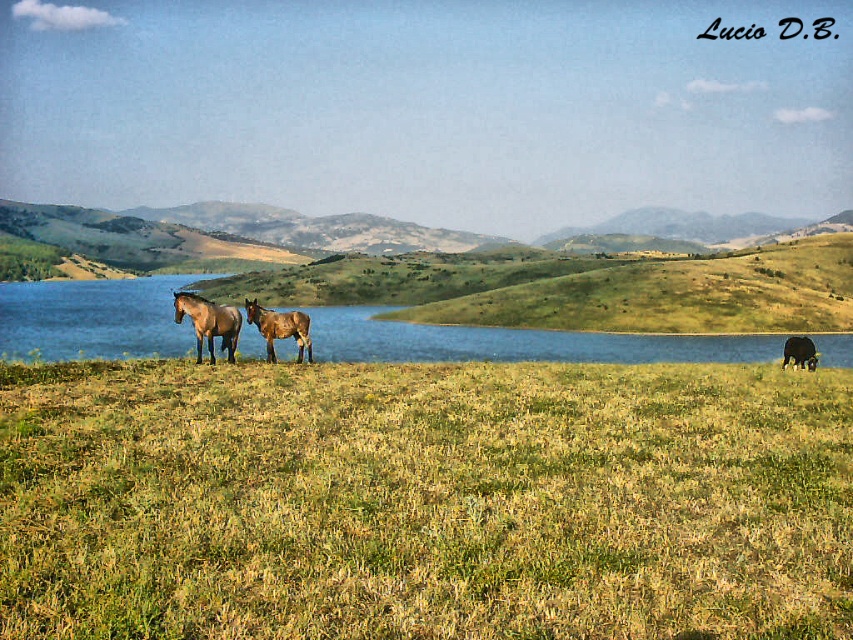
You are a farmer checking on your horses in the field. You notice both the brown matte horse at center and the brown glossy horse at center. Which horse do you need to check for potential health issues related to height differences?

The brown matte horse at center is taller than the brown glossy horse at center, so you should check the brown glossy horse at center for potential health issues as it appears smaller in stature.

You are standing at the origin point of the image. Where is the green grassy field at lower center located in terms of coordinates?

The green grassy field at lower center is located at coordinates point (424, 500).

You are a farmer who needs to separate two horses with a fence. The brown matte horse at center is one of them. What is the minimum length of the fence required to ensure they are separated?

The minimum length of the fence required to separate the two horses is 19.34 meters, as they are 19.34 meters apart.